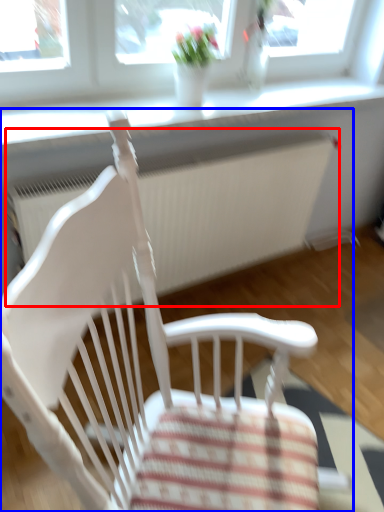
Question: Among these objects, which one is nearest to the camera, radiator (highlighted by a red box) or chair (highlighted by a blue box)?

Choices:
 (A) radiator
 (B) chair

Answer: (B)